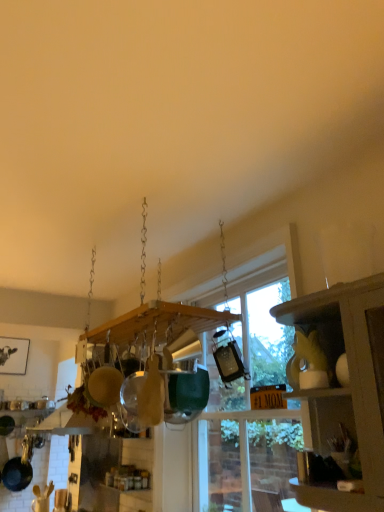
Question: Is matte yellow cabinet at right at the back of transparent glass window at center?

Choices:
 (A) no
 (B) yes

Answer: (A)

Question: Considering the relative positions of transparent glass window at center and matte yellow cabinet at right in the image provided, is transparent glass window at center behind matte yellow cabinet at right?

Choices:
 (A) yes
 (B) no

Answer: (A)

Question: Does transparent glass window at center have a lesser height compared to matte yellow cabinet at right?

Choices:
 (A) yes
 (B) no

Answer: (B)

Question: From a real-world perspective, is transparent glass window at center located beneath matte yellow cabinet at right?

Choices:
 (A) yes
 (B) no

Answer: (B)

Question: Is transparent glass window at center smaller than matte yellow cabinet at right?

Choices:
 (A) no
 (B) yes

Answer: (A)

Question: Considering the relative sizes of transparent glass window at center and matte yellow cabinet at right in the image provided, is transparent glass window at center taller than matte yellow cabinet at right?

Choices:
 (A) yes
 (B) no

Answer: (A)

Question: Can you see matte yellow cabinet at right touching transparent glass window at center?

Choices:
 (A) no
 (B) yes

Answer: (A)

Question: Is matte yellow cabinet at right oriented away from transparent glass window at center?

Choices:
 (A) yes
 (B) no

Answer: (B)

Question: Considering the relative sizes of matte yellow cabinet at right and transparent glass window at center in the image provided, is matte yellow cabinet at right bigger than transparent glass window at center?

Choices:
 (A) yes
 (B) no

Answer: (B)

Question: From the image's perspective, would you say matte yellow cabinet at right is shown under transparent glass window at center?

Choices:
 (A) no
 (B) yes

Answer: (A)

Question: Is matte yellow cabinet at right not near transparent glass window at center?

Choices:
 (A) yes
 (B) no

Answer: (B)

Question: Could you tell me if matte yellow cabinet at right is turned towards transparent glass window at center?

Choices:
 (A) yes
 (B) no

Answer: (B)

Question: Is black matte frying pan at lower left wider than matte yellow cabinet at right?

Choices:
 (A) no
 (B) yes

Answer: (A)